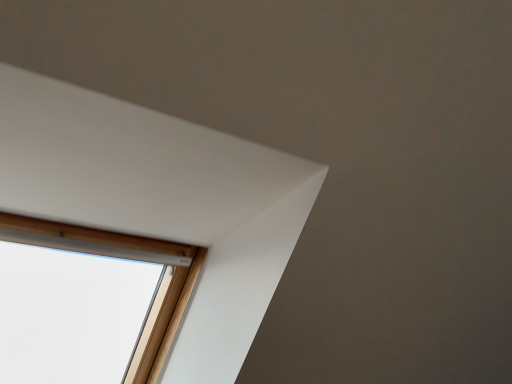
Image resolution: width=512 pixels, height=384 pixels. What do you see at coordinates (127, 258) in the screenshot?
I see `wooden frame window at upper left` at bounding box center [127, 258].

You are a GUI agent. You are given a task and a screenshot of the screen. Output one action in this format:
    pyautogui.click(x=<x>, y=<y>)
    Task: Click on the wooden frame window at upper left
    Image resolution: width=512 pixels, height=384 pixels.
    Given the screenshot: What is the action you would take?
    pyautogui.click(x=127, y=258)

Where is `wooden frame window at upper left`? wooden frame window at upper left is located at coordinates (127, 258).